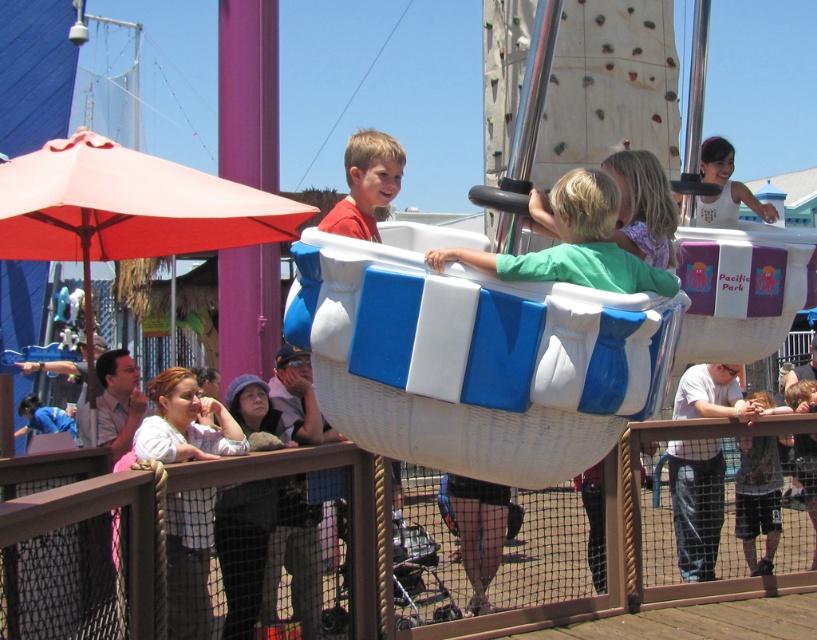
How distant is green matte shirt at center from white cotton shirt at center?

They are 6.75 meters apart.

Does green matte shirt at center have a greater height compared to white cotton shirt at center?

No.

Where is `green matte shirt at center`? The width and height of the screenshot is (817, 640). green matte shirt at center is located at coordinates (572, 244).

At what (x,y) coordinates should I click in order to perform the action: click on green matte shirt at center. Please return your answer as a coordinate pair (x, y). Looking at the image, I should click on (572, 244).

Does white cotton shirt at center have a lesser height compared to camouflage-patterned shorts at lower right?

Correct, white cotton shirt at center is not as tall as camouflage-patterned shorts at lower right.

Measure the distance from white cotton shirt at center to camouflage-patterned shorts at lower right.

white cotton shirt at center is 30.30 inches away from camouflage-patterned shorts at lower right.

Identify the location of white cotton shirt at center. Image resolution: width=817 pixels, height=640 pixels. (695, 502).

Can you confirm if camouflage-patterned shorts at lower right is wider than matte red shirt at center?

Incorrect, camouflage-patterned shorts at lower right's width does not surpass matte red shirt at center's.

Is point (766, 436) positioned before point (369, 230)?

No.

At what (x,y) coordinates should I click in order to perform the action: click on camouflage-patterned shorts at lower right. Please return your answer as a coordinate pair (x, y). Looking at the image, I should click on (757, 499).